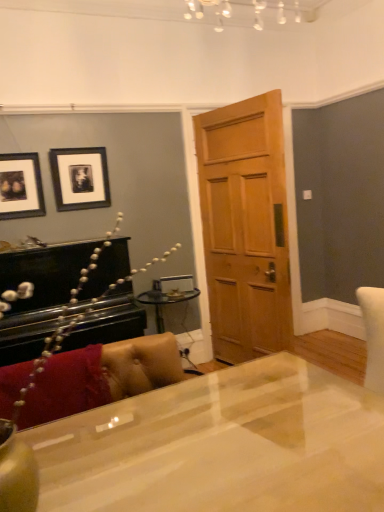
In order to face glossy white desk at center, should I rotate leftwards or rightwards?

Rotate right and turn 4.879 degrees.

What is the approximate width of leather couch at lower left?

It is 8.68 inches.

What do you see at coordinates (101, 377) in the screenshot? I see `leather couch at lower left` at bounding box center [101, 377].

You are a GUI agent. You are given a task and a screenshot of the screen. Output one action in this format:
    pyautogui.click(x=<x>, y=<y>)
    Task: Click on the black matte picture frame at upper left, which is counted as the 1th picture frame, starting from the right
    Image resolution: width=384 pixels, height=512 pixels.
    Given the screenshot: What is the action you would take?
    pyautogui.click(x=80, y=178)

In order to click on wooden door at center in this screenshot , I will do `click(245, 227)`.

From a real-world perspective, who is located lower, leather couch at lower left or black matte picture frame at upper left, placed as the 2th picture frame when sorted from left to right?

leather couch at lower left.

Is leather couch at lower left with black matte picture frame at upper left, placed as the 2th picture frame when sorted from left to right?

No.

From the image's perspective, which object appears higher, leather couch at lower left or black matte picture frame at upper left, which is counted as the 1th picture frame, starting from the right?

From the image's view, black matte picture frame at upper left, which is counted as the 1th picture frame, starting from the right, is above.

Locate an element on the screen. The height and width of the screenshot is (512, 384). desk below the leather couch at lower left (from the image's perspective) is located at coordinates (221, 446).

Is glossy white desk at center situated inside leather couch at lower left or outside?

glossy white desk at center is not enclosed by leather couch at lower left.

Is glossy white desk at center aimed at leather couch at lower left?

No, glossy white desk at center is not turned towards leather couch at lower left.

Is leather couch at lower left at the left side of matte black picture frame at upper left, marked as the 2th picture frame in a right-to-left arrangement?

In fact, leather couch at lower left is to the right of matte black picture frame at upper left, marked as the 2th picture frame in a right-to-left arrangement.

Would you say leather couch at lower left contains matte black picture frame at upper left, the first picture frame from the left?

Definitely not — matte black picture frame at upper left, the first picture frame from the left, is not inside leather couch at lower left.

Is leather couch at lower left far from matte black picture frame at upper left, marked as the 2th picture frame in a right-to-left arrangement?

Yes, leather couch at lower left is far from matte black picture frame at upper left, marked as the 2th picture frame in a right-to-left arrangement.

From a real-world perspective, between leather couch at lower left and matte black picture frame at upper left, the first picture frame from the left, who is vertically lower?

leather couch at lower left is physically lower.

Considering the sizes of matte black picture frame at upper left, marked as the 2th picture frame in a right-to-left arrangement, and wooden door at center in the image, is matte black picture frame at upper left, marked as the 2th picture frame in a right-to-left arrangement, wider or thinner than wooden door at center?

matte black picture frame at upper left, marked as the 2th picture frame in a right-to-left arrangement, is thinner than wooden door at center.

From the image's perspective, is matte black picture frame at upper left, the first picture frame from the left, over wooden door at center?

Yes.

Is matte black picture frame at upper left, the first picture frame from the left, oriented towards wooden door at center?

No, matte black picture frame at upper left, the first picture frame from the left, is not turned towards wooden door at center.

From the picture: Which is closer to the camera, (x=3, y=216) or (x=232, y=148)?

Point (x=3, y=216).

In terms of size, does matte black picture frame at upper left, the first picture frame from the left, appear bigger or smaller than glossy white desk at center?

matte black picture frame at upper left, the first picture frame from the left, is smaller than glossy white desk at center.

Would you say matte black picture frame at upper left, marked as the 2th picture frame in a right-to-left arrangement, is outside glossy white desk at center?

That's correct, matte black picture frame at upper left, marked as the 2th picture frame in a right-to-left arrangement, is outside of glossy white desk at center.

From a real-world perspective, between matte black picture frame at upper left, the first picture frame from the left, and glossy white desk at center, who is vertically lower?

glossy white desk at center, from a real-world perspective.

Is matte black picture frame at upper left, the first picture frame from the left, wider than glossy white desk at center?

In fact, matte black picture frame at upper left, the first picture frame from the left, might be narrower than glossy white desk at center.

Considering the sizes of objects black matte picture frame at upper left, placed as the 2th picture frame when sorted from left to right, and matte black picture frame at upper left, marked as the 2th picture frame in a right-to-left arrangement, in the image provided, who is bigger, black matte picture frame at upper left, placed as the 2th picture frame when sorted from left to right, or matte black picture frame at upper left, marked as the 2th picture frame in a right-to-left arrangement,?

black matte picture frame at upper left, placed as the 2th picture frame when sorted from left to right, is bigger.

Who is taller, black matte picture frame at upper left, which is counted as the 1th picture frame, starting from the right, or matte black picture frame at upper left, marked as the 2th picture frame in a right-to-left arrangement?

black matte picture frame at upper left, which is counted as the 1th picture frame, starting from the right, is taller.

From a real-world perspective, is black matte picture frame at upper left, which is counted as the 1th picture frame, starting from the right, positioned above or below matte black picture frame at upper left, marked as the 2th picture frame in a right-to-left arrangement?

From a real-world perspective, black matte picture frame at upper left, which is counted as the 1th picture frame, starting from the right, is physically above matte black picture frame at upper left, marked as the 2th picture frame in a right-to-left arrangement.

Considering the sizes of objects black matte picture frame at upper left, which is counted as the 1th picture frame, starting from the right, and matte black picture frame at upper left, the first picture frame from the left, in the image provided, who is thinner, black matte picture frame at upper left, which is counted as the 1th picture frame, starting from the right, or matte black picture frame at upper left, the first picture frame from the left,?

With smaller width is matte black picture frame at upper left, the first picture frame from the left.

Locate an element on the screen. The image size is (384, 512). door below the matte black picture frame at upper left, the first picture frame from the left (from the image's perspective) is located at coordinates click(x=245, y=227).

Is wooden door at center turned away from matte black picture frame at upper left, marked as the 2th picture frame in a right-to-left arrangement?

Yes, wooden door at center is facing away from matte black picture frame at upper left, marked as the 2th picture frame in a right-to-left arrangement.

Is wooden door at center bigger than matte black picture frame at upper left, the first picture frame from the left?

Indeed, wooden door at center has a larger size compared to matte black picture frame at upper left, the first picture frame from the left.

Is wooden door at center to the left of matte black picture frame at upper left, marked as the 2th picture frame in a right-to-left arrangement, from the viewer's perspective?

In fact, wooden door at center is to the right of matte black picture frame at upper left, marked as the 2th picture frame in a right-to-left arrangement.

Find the location of a particular element. This screenshot has width=384, height=512. couch below the black matte picture frame at upper left, placed as the 2th picture frame when sorted from left to right (from the image's perspective) is located at coordinates (101, 377).

The width and height of the screenshot is (384, 512). Find the location of `couch to the left of glossy white desk at center`. couch to the left of glossy white desk at center is located at coordinates (101, 377).

Estimate the real-world distances between objects in this image. Which object is further from matte black picture frame at upper left, the first picture frame from the left, black matte picture frame at upper left, placed as the 2th picture frame when sorted from left to right, or glossy white desk at center?

glossy white desk at center.

Based on their spatial positions, is leather couch at lower left or wooden door at center closer to black matte picture frame at upper left, which is counted as the 1th picture frame, starting from the right?

wooden door at center is closer to black matte picture frame at upper left, which is counted as the 1th picture frame, starting from the right.

Which object lies nearer to the anchor point leather couch at lower left, wooden door at center or matte black picture frame at upper left, marked as the 2th picture frame in a right-to-left arrangement?

Based on the image, matte black picture frame at upper left, marked as the 2th picture frame in a right-to-left arrangement, appears to be nearer to leather couch at lower left.

Based on their spatial positions, is black matte picture frame at upper left, which is counted as the 1th picture frame, starting from the right, or matte black picture frame at upper left, marked as the 2th picture frame in a right-to-left arrangement, closer to wooden door at center?

Among the two, black matte picture frame at upper left, which is counted as the 1th picture frame, starting from the right, is located nearer to wooden door at center.

Considering their positions, is black matte picture frame at upper left, which is counted as the 1th picture frame, starting from the right, positioned closer to glossy white desk at center than matte black picture frame at upper left, marked as the 2th picture frame in a right-to-left arrangement?

Based on the image, black matte picture frame at upper left, which is counted as the 1th picture frame, starting from the right, appears to be nearer to glossy white desk at center.

Considering their positions, is matte black picture frame at upper left, marked as the 2th picture frame in a right-to-left arrangement, positioned closer to glossy white desk at center than wooden door at center?

Based on the image, wooden door at center appears to be nearer to glossy white desk at center.

When comparing their distances from wooden door at center, does leather couch at lower left or black matte picture frame at upper left, placed as the 2th picture frame when sorted from left to right, seem further?

leather couch at lower left is further to wooden door at center.

Looking at this image, considering their positions, is wooden door at center positioned further to black matte picture frame at upper left, placed as the 2th picture frame when sorted from left to right, than glossy white desk at center?

glossy white desk at center lies further to black matte picture frame at upper left, placed as the 2th picture frame when sorted from left to right, than the other object.

This screenshot has height=512, width=384. What are the coordinates of `picture frame situated between matte black picture frame at upper left, marked as the 2th picture frame in a right-to-left arrangement, and wooden door at center from left to right` in the screenshot? It's located at (80, 178).

This screenshot has width=384, height=512. What are the coordinates of `door located between glossy white desk at center and black matte picture frame at upper left, which is counted as the 1th picture frame, starting from the right, in the depth direction` in the screenshot? It's located at click(x=245, y=227).

Find the location of a particular element. This screenshot has height=512, width=384. couch between glossy white desk at center and wooden door at center in the front-back direction is located at coordinates (101, 377).

At what (x,y) coordinates should I click in order to perform the action: click on door positioned between leather couch at lower left and black matte picture frame at upper left, which is counted as the 1th picture frame, starting from the right, from near to far. Please return your answer as a coordinate pair (x, y). Looking at the image, I should click on (245, 227).